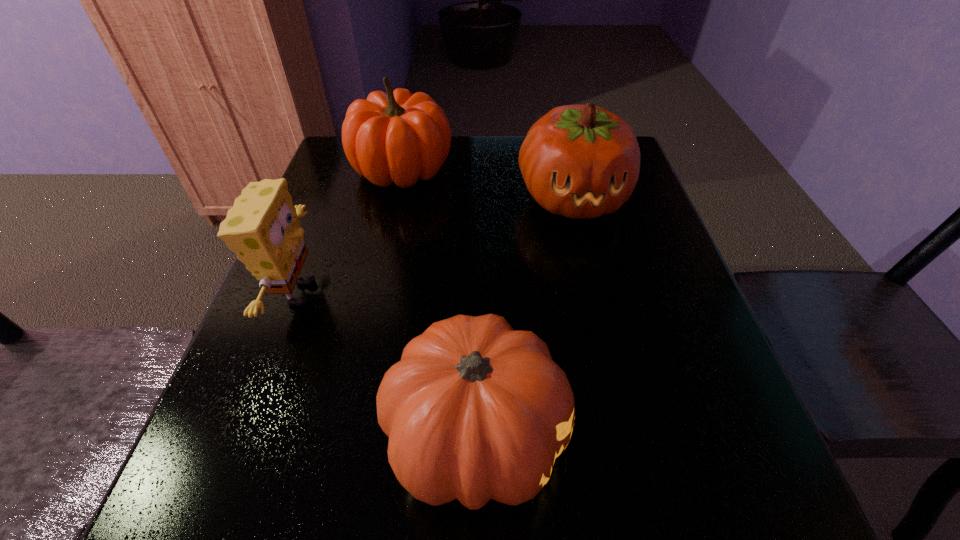
At what (x,y) coordinates should I click in order to perform the action: click on pumpkin object that ranks as the closest to the nearest pumpkin. Please return your answer as a coordinate pair (x, y). The width and height of the screenshot is (960, 540). Looking at the image, I should click on (580, 161).

You are a GUI agent. You are given a task and a screenshot of the screen. Output one action in this format:
    pyautogui.click(x=<x>, y=<y>)
    Task: Click on the pumpkin that is the second closest one to the nearest object
    The height and width of the screenshot is (540, 960).
    Given the screenshot: What is the action you would take?
    pyautogui.click(x=398, y=137)